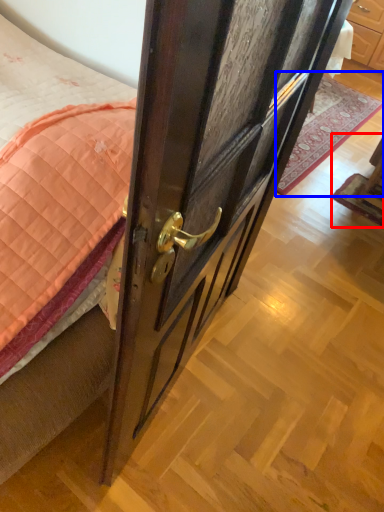
Question: Which of the following is the farthest to the observer, furniture (highlighted by a red box) or plain (highlighted by a blue box)?

Choices:
 (A) furniture
 (B) plain

Answer: (B)